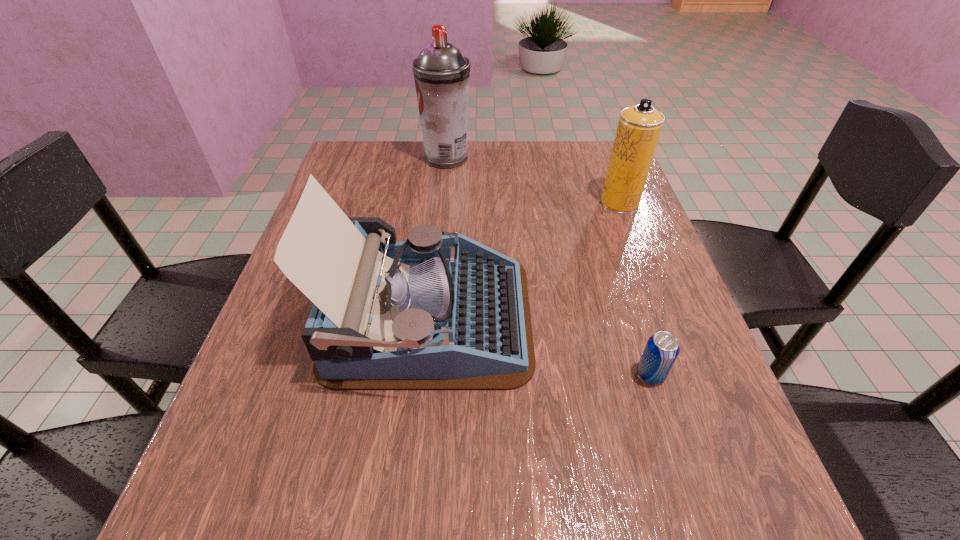
You are a GUI agent. You are given a task and a screenshot of the screen. Output one action in this format:
    pyautogui.click(x=<x>, y=<y>)
    Task: Click on the object at the far edge
    
    Given the screenshot: What is the action you would take?
    pyautogui.click(x=441, y=73)

What are the coordinates of `object located at the left edge` in the screenshot? It's located at (434, 312).

You are a GUI agent. You are given a task and a screenshot of the screen. Output one action in this format:
    pyautogui.click(x=<x>, y=<y>)
    Task: Click on the aerosol can present at the right edge
    
    Given the screenshot: What is the action you would take?
    pyautogui.click(x=639, y=127)

Where is `beer can present at the right edge`? This screenshot has width=960, height=540. beer can present at the right edge is located at coordinates (662, 349).

Identify the location of vacant space at the far edge of the desktop. This screenshot has width=960, height=540. (506, 151).

I want to click on vacant space at the near edge, so click(x=342, y=515).

Find the location of `vacant space at the left edge`. vacant space at the left edge is located at coordinates (289, 325).

At what (x,y) coordinates should I click in order to perform the action: click on free point at the right edge. Please return your answer as a coordinate pair (x, y). This screenshot has height=540, width=960. Looking at the image, I should click on (614, 217).

At what (x,y) coordinates should I click in order to perform the action: click on free space at the far left corner of the desktop. Please return your answer as a coordinate pair (x, y). The image size is (960, 540). Looking at the image, I should click on (389, 171).

In the image, there is a desktop. Identify the location of blank space at the far right corner. (569, 141).